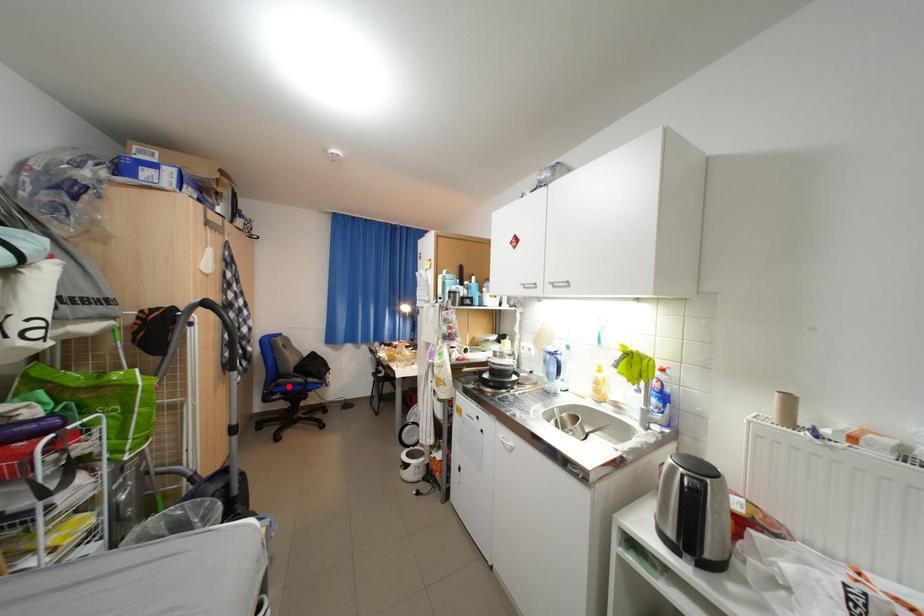
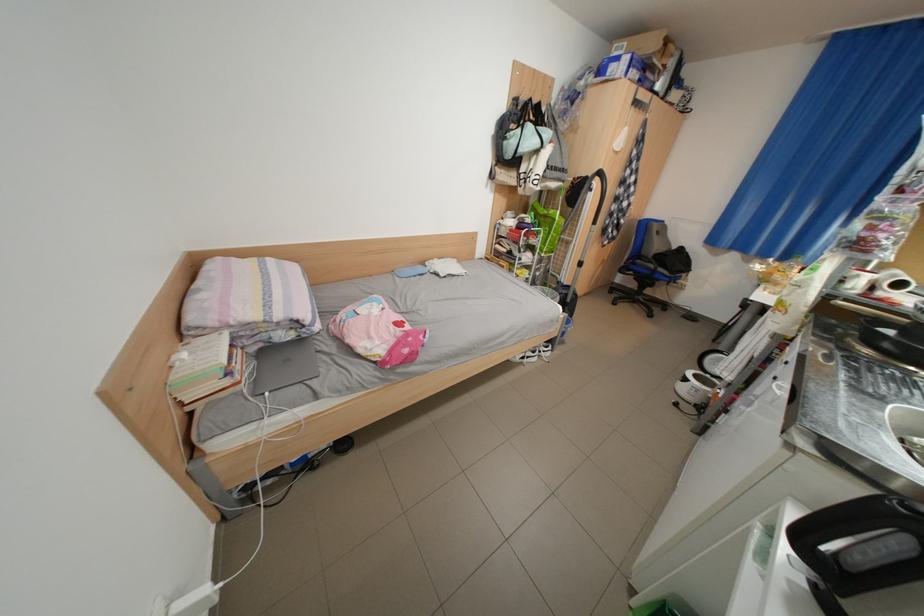
Question: A red point is marked in image1. In image2, is the corresponding 3D point closer to the camera or farther? Reply with the corresponding letter.

Choices:
 (A) The corresponding 3D point is closer.
 (B) The corresponding 3D point is farther.

Answer: (A)